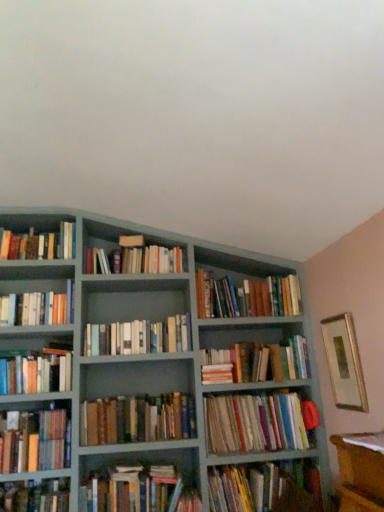
Question: From the image's perspective, is hardcover books at center, positioned as the ninth book in bottom-to-top order, above or below hardcover books at left, the tenth book from the bottom?

Choices:
 (A) above
 (B) below

Answer: (B)

Question: Is hardcover books at center, the 5th book positioned from the top, to the left or to the right of hardcover books at left, the tenth book from the bottom, in the image?

Choices:
 (A) right
 (B) left

Answer: (A)

Question: Which object is positioned farthest from the hardcover books at upper center, acting as the 2th book starting from the top?

Choices:
 (A) hardcover books at upper left, which is counted as the 13th book, starting from the bottom
 (B) hardcover books at center, the 5th book positioned from the top
 (C) matte gray bookcase at center
 (D) brown leather book at center, which is the 8th book in top-to-bottom order
 (E) hardcover books at center, positioned as the 3th book in top-to-bottom order

Answer: (D)

Question: Which is farther from the matte gray bookcase at center?

Choices:
 (A) hardcover books at lower center, acting as the twelfth book starting from the top
 (B) hardcover books at center, positioned as the eighth book in bottom-to-top order
 (C) hardcover books at upper center, the 12th book when ordered from bottom to top
 (D) hardcover books at upper left, which is counted as the 13th book, starting from the bottom
 (E) brown leather book at center, which is the 8th book in top-to-bottom order

Answer: (D)